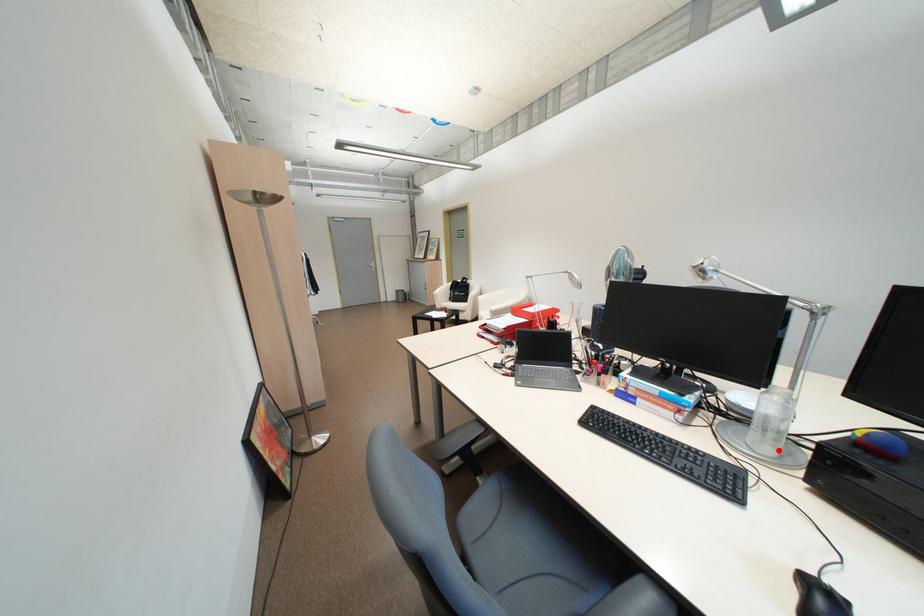
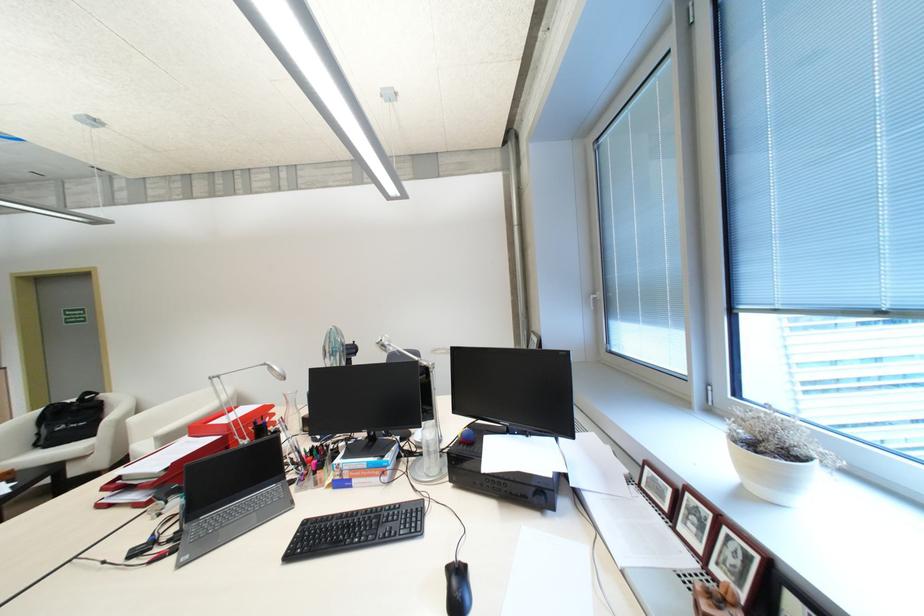
In the second image, find the point that corresponds to the highlighted location in the first image.

(444, 469)